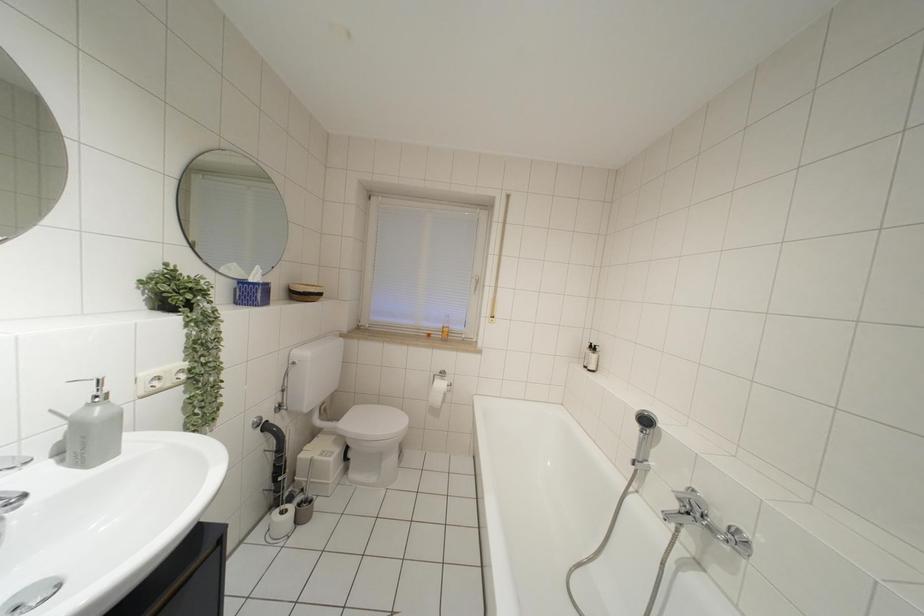
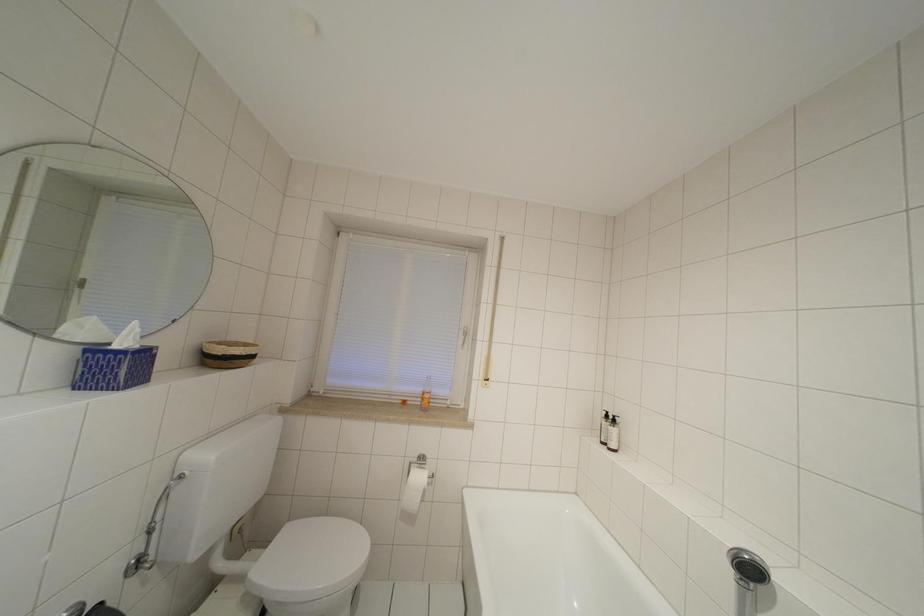
Question: The images are taken continuously from a first-person perspective. In which direction are you moving?

Choices:
 (A) Left
 (B) Right
 (C) Forward
 (D) Backward

Answer: (C)